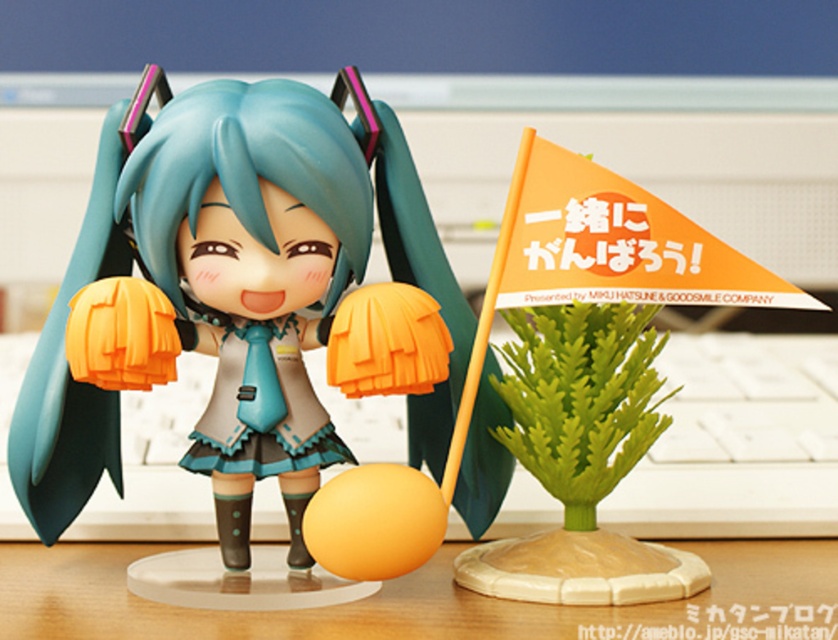
From the picture: You are a collector who wants to place a new accessory on the wooden table at center. However, you need to ensure it won not block the view of the matte plastic doll at center. Where should you place the accessory?

Place the accessory on the right side of the wooden table at center, since the matte plastic doll at center is on the left side, leaving the right side unobstructed for the accessory.

You are a customer at a gift shop and see the matte plastic doll at center and the wooden table at center. Which object is closer to you?

The matte plastic doll at center is closer to you because the wooden table at center is behind it.

What is the location of the point with coordinates (242, 300) in the image?

The point with coordinates (242, 300) corresponds to the matte plastic doll at center.